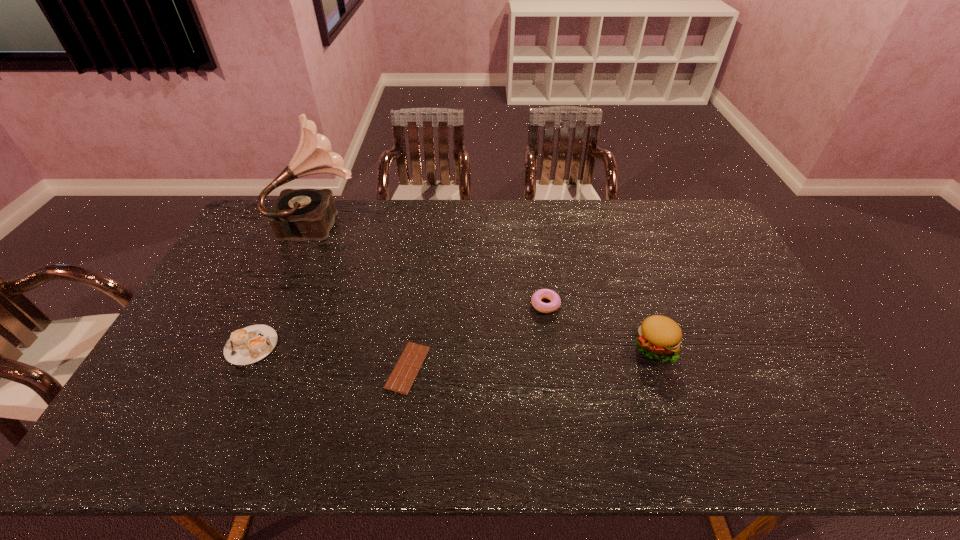
Identify the location of vacant position located 0.260m on the left of the hamburger. This screenshot has width=960, height=540. (539, 346).

Find the location of a particular element. The image size is (960, 540). vacant space situated on the back of the doughnut is located at coordinates (541, 276).

I want to click on free spot located 0.310m on the back of the cappuccino, so click(x=293, y=255).

You are a GUI agent. You are given a task and a screenshot of the screen. Output one action in this format:
    pyautogui.click(x=<x>, y=<y>)
    Task: Click on the free location located 0.180m on the right of the shortest object
    
    Given the screenshot: What is the action you would take?
    pyautogui.click(x=496, y=367)

You are a GUI agent. You are given a task and a screenshot of the screen. Output one action in this format:
    pyautogui.click(x=<x>, y=<y>)
    Task: Click on the object present at the far edge
    
    Given the screenshot: What is the action you would take?
    pyautogui.click(x=298, y=214)

Locate an element on the screen. record player that is at the left edge is located at coordinates (298, 214).

The height and width of the screenshot is (540, 960). What are the coordinates of `cappuccino that is at the left edge` in the screenshot? It's located at (245, 346).

Where is `object located in the far left corner section of the desktop`? This screenshot has height=540, width=960. object located in the far left corner section of the desktop is located at coordinates 298,214.

What are the coordinates of `vacant region at the far edge of the desktop` in the screenshot? It's located at (611, 225).

In the image, there is a desktop. Identify the location of vacant space at the near edge. (509, 453).